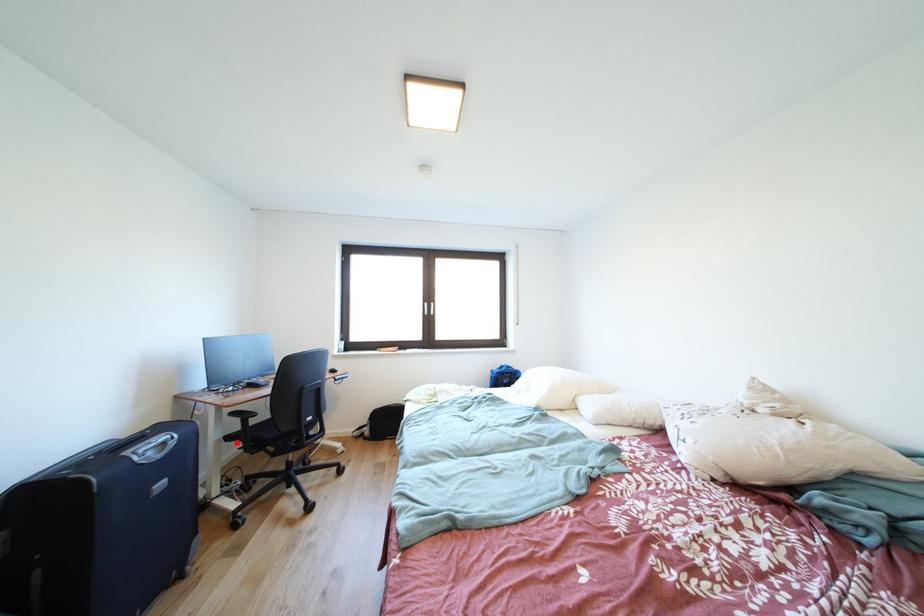
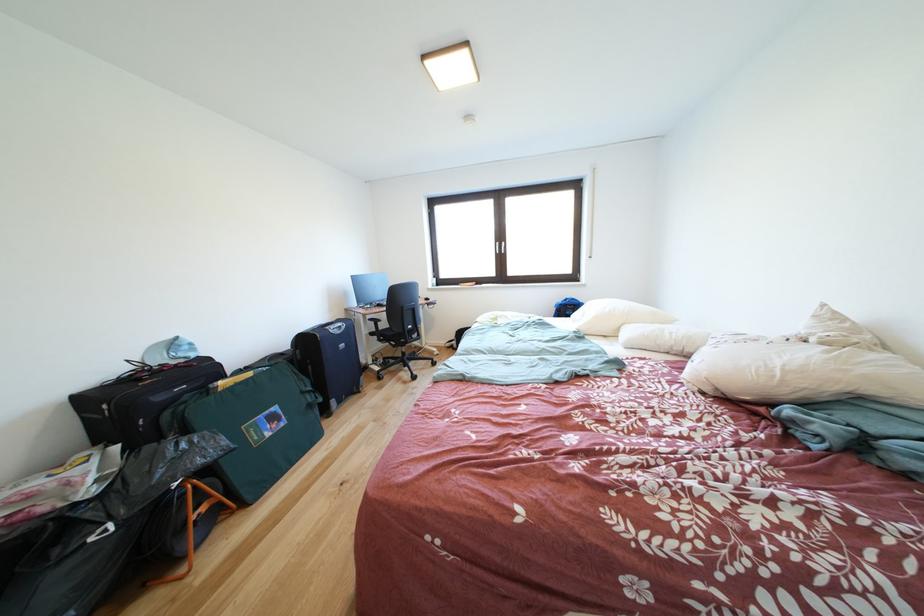
The point at the highlighted location is marked in the first image. Where is the corresponding point in the second image?

(380, 339)